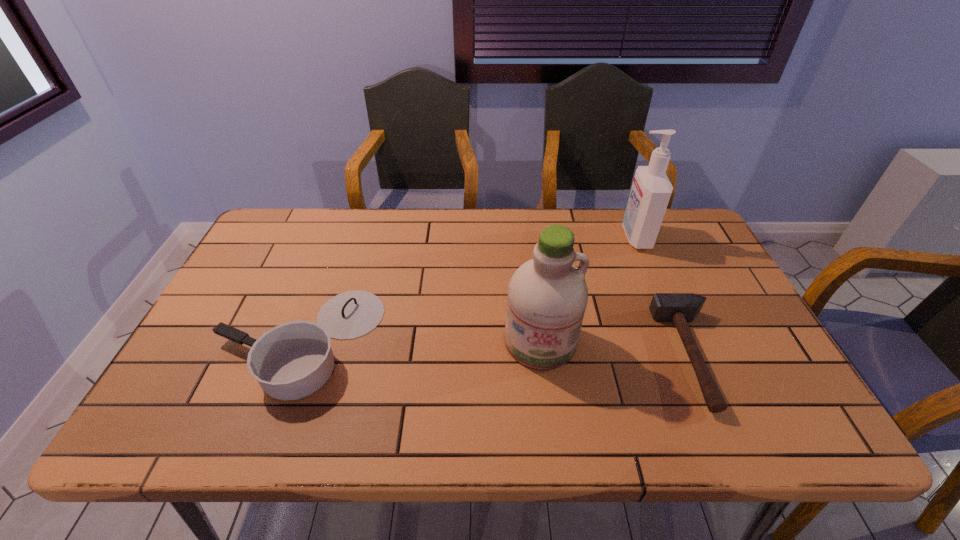
Image resolution: width=960 pixels, height=540 pixels. What are the coordinates of `free space located on the front label of the left cleansing agent` in the screenshot? It's located at (551, 427).

Find the location of a particular element. vacant region located 0.270m on the back of the second shortest object is located at coordinates (341, 232).

Identify the location of free region located 0.200m on the striking surface of the shortest object. Image resolution: width=960 pixels, height=540 pixels. (583, 355).

I want to click on free spot located on the striking surface of the shortest object, so (x=608, y=355).

The width and height of the screenshot is (960, 540). I want to click on vacant space situated on the striking surface of the shortest object, so click(534, 355).

Locate an element on the screen. The image size is (960, 540). object situated at the far edge is located at coordinates (651, 190).

Find the location of a particular element. Image resolution: width=960 pixels, height=540 pixels. saucepan that is at the near edge is located at coordinates (293, 360).

Locate an element on the screen. The height and width of the screenshot is (540, 960). hammer at the near edge is located at coordinates (680, 308).

Locate an element on the screen. The height and width of the screenshot is (540, 960). object at the left edge is located at coordinates (293, 360).

Where is `cleansing agent that is at the right edge`? cleansing agent that is at the right edge is located at coordinates coord(651,190).